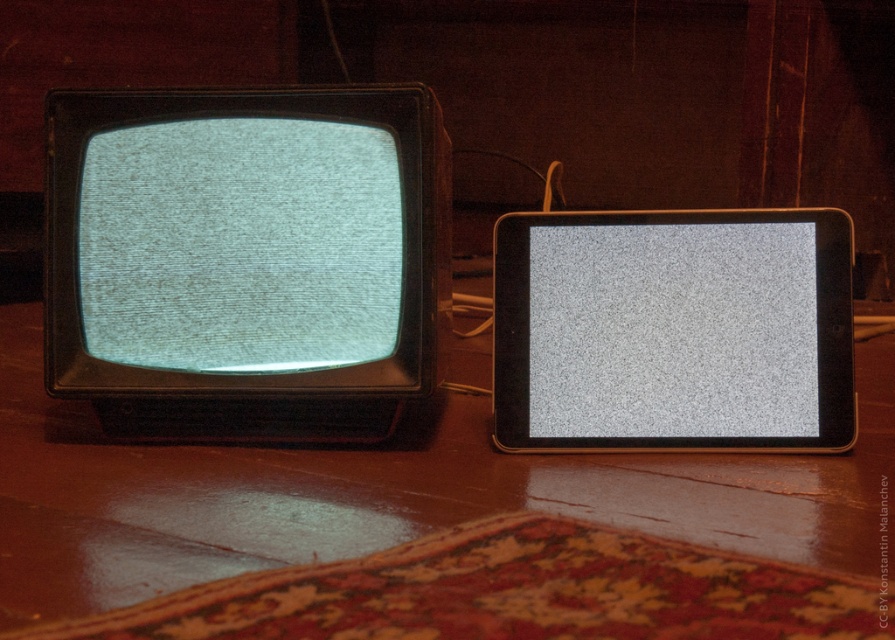
Does wooden table at center appear on the left side of teal matte screen at left?

Incorrect, wooden table at center is not on the left side of teal matte screen at left.

Is the position of wooden table at center less distant than that of teal matte screen at left?

Yes, it is in front of teal matte screen at left.

Is point (863, 520) positioned in front of point (348, 250)?

Yes, it is in front of point (348, 250).

This screenshot has height=640, width=895. Find the location of `wooden table at center`. wooden table at center is located at coordinates coord(386,492).

Is teal matte screen at left shorter than gray matte screen at center?

No, teal matte screen at left is not shorter than gray matte screen at center.

Is point (182, 256) behind point (757, 232)?

No, (182, 256) is closer to viewer.

Identify the location of teal matte screen at left. This screenshot has width=895, height=640. (240, 244).

Based on the photo, which of these two, wooden table at center or gray matte screen at center, stands shorter?

Standing shorter between the two is gray matte screen at center.

Does point (493, 484) lie in front of point (603, 362)?

Yes, it is in front of point (603, 362).

Does point (553, 502) come farther from viewer compared to point (744, 429)?

That is False.

Locate an element on the screen. Image resolution: width=895 pixels, height=640 pixels. wooden table at center is located at coordinates (386, 492).